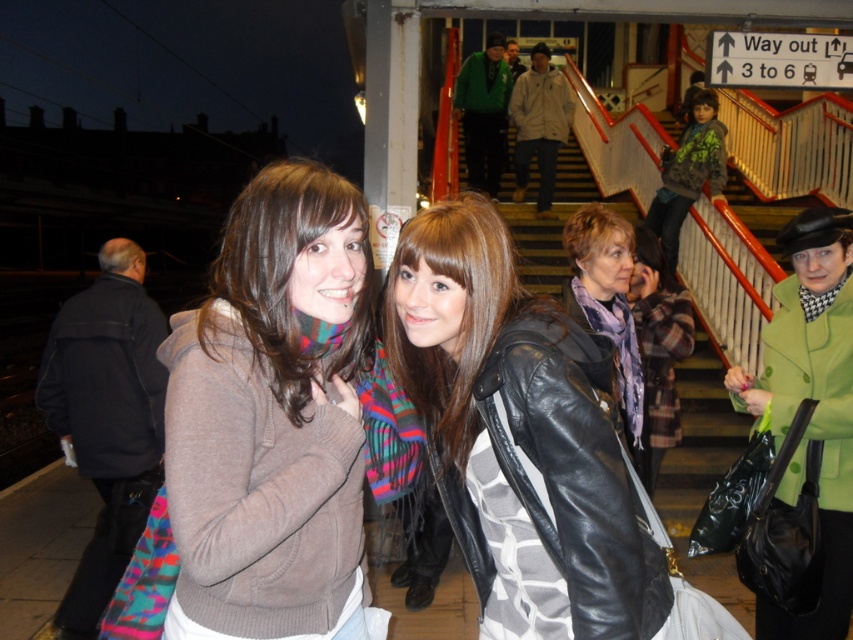
You are a photographer trying to capture a wide shot of the scene. You want to ensure both the leather jacket at center and the green textured hoodie at upper right are fully visible in the frame. Given their sizes, which clothing item might require you to adjust your camera angle to avoid being cut off?

The green textured hoodie at upper right has a greater width than the leather jacket at center, so it might require adjusting the camera angle to ensure it is fully visible in the frame.

You are standing at the point with coordinates (519, 435) in the train station scene. What object is located exactly at that coordinate?

The point at coordinates (519, 435) corresponds to the leather jacket at center.

You are a photographer at the train station and want to ensure that both the matte brown sweater at center and the purple scarf at center are clearly visible in your photo. Given their sizes, which object might you need to adjust your camera focus on to capture more detail?

The matte brown sweater at center is smaller in size compared to the purple scarf at center, so you should focus on the matte brown sweater at center to ensure its details are captured clearly.